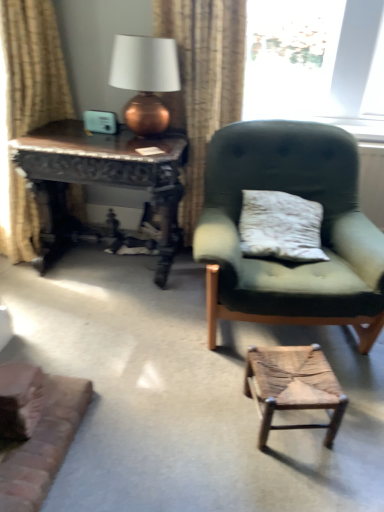
Question: Can you confirm if beige fabric curtain at left, positioned as the 2th curtain in right-to-left order, is taller than wooden carved table at left?

Choices:
 (A) yes
 (B) no

Answer: (A)

Question: Does beige fabric curtain at left, positioned as the 2th curtain in right-to-left order, touch wooden carved table at left?

Choices:
 (A) yes
 (B) no

Answer: (B)

Question: Considering the relative positions of beige fabric curtain at left, positioned as the 2th curtain in right-to-left order, and wooden carved table at left in the image provided, is beige fabric curtain at left, positioned as the 2th curtain in right-to-left order, to the left of wooden carved table at left from the viewer's perspective?

Choices:
 (A) yes
 (B) no

Answer: (A)

Question: Are beige fabric curtain at left, positioned as the 2th curtain in right-to-left order, and wooden carved table at left far apart?

Choices:
 (A) yes
 (B) no

Answer: (B)

Question: Is wooden carved table at left surrounded by beige fabric curtain at left, positioned as the 2th curtain in right-to-left order?

Choices:
 (A) no
 (B) yes

Answer: (A)

Question: Does beige fabric curtain at left, the first curtain when ordered from left to right, come behind wooden carved table at left?

Choices:
 (A) no
 (B) yes

Answer: (A)

Question: From a real-world perspective, is copper metallic table lamp at upper left physically above beige textured curtain at upper center, acting as the first curtain starting from the right?

Choices:
 (A) no
 (B) yes

Answer: (B)

Question: From the image's perspective, does copper metallic table lamp at upper left appear higher than beige textured curtain at upper center, which is the 2th curtain from left to right?

Choices:
 (A) no
 (B) yes

Answer: (B)

Question: Is copper metallic table lamp at upper left placed right next to beige textured curtain at upper center, which is the 2th curtain from left to right?

Choices:
 (A) no
 (B) yes

Answer: (A)

Question: Is beige textured curtain at upper center, which is the 2th curtain from left to right, at the back of copper metallic table lamp at upper left?

Choices:
 (A) no
 (B) yes

Answer: (B)

Question: Does copper metallic table lamp at upper left have a smaller size compared to beige textured curtain at upper center, acting as the first curtain starting from the right?

Choices:
 (A) no
 (B) yes

Answer: (B)

Question: Is the position of copper metallic table lamp at upper left less distant than that of beige textured curtain at upper center, acting as the first curtain starting from the right?

Choices:
 (A) no
 (B) yes

Answer: (B)

Question: Is rustic wood stool at lower center surrounding wooden carved table at left?

Choices:
 (A) no
 (B) yes

Answer: (A)